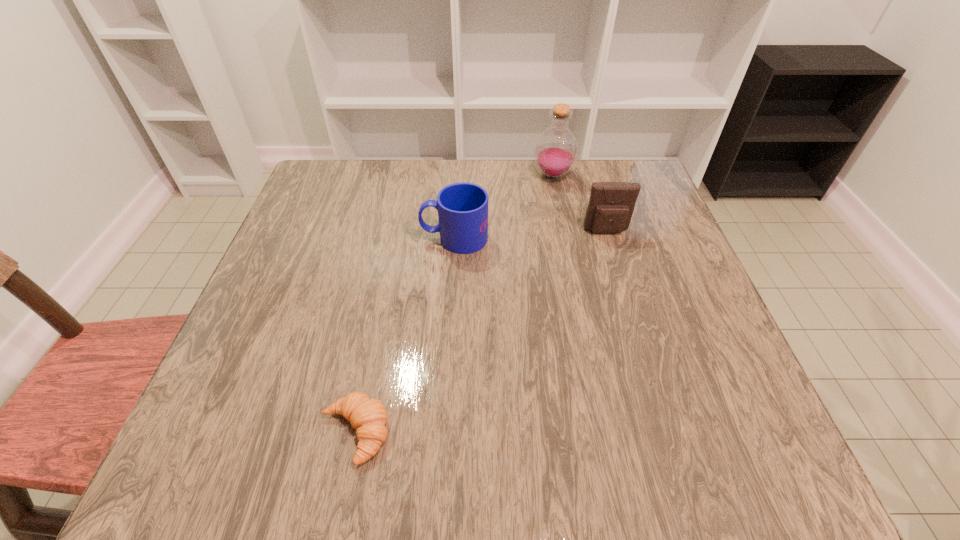
Locate an element on the screen. blank area at the far right corner is located at coordinates (635, 168).

Where is `free space at the near right corner of the desktop`? free space at the near right corner of the desktop is located at coordinates (763, 458).

Identify the location of free space between the second object from left to right and the bottle. (504, 206).

The height and width of the screenshot is (540, 960). In order to click on vacant area between the shortest object and the mug in this screenshot , I will do pyautogui.click(x=405, y=335).

Find the location of a particular element. This screenshot has width=960, height=540. empty location between the pouch and the farthest object is located at coordinates (580, 203).

The height and width of the screenshot is (540, 960). Find the location of `unoccupied area between the pouch and the nearest object`. unoccupied area between the pouch and the nearest object is located at coordinates (481, 332).

Identify the location of free space between the nearest object and the pouch. (481, 332).

You are a GUI agent. You are given a task and a screenshot of the screen. Output one action in this format:
    pyautogui.click(x=<x>, y=<y>)
    Task: Click on the free space between the bottle and the leftmost object
    Image resolution: width=960 pixels, height=540 pixels.
    Given the screenshot: What is the action you would take?
    pyautogui.click(x=454, y=304)

I want to click on vacant area between the tallest object and the nearest object, so click(x=454, y=304).

Where is `vacant point located between the second object from left to right and the pouch`? vacant point located between the second object from left to right and the pouch is located at coordinates (530, 234).